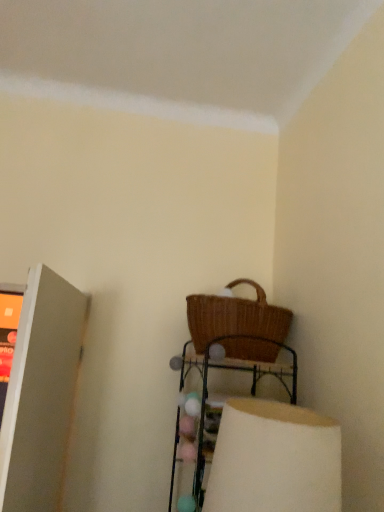
This screenshot has height=512, width=384. What do you see at coordinates (41, 393) in the screenshot?
I see `matte gray shelf at left` at bounding box center [41, 393].

Describe the element at coordinates (238, 324) in the screenshot. I see `woven brown picnic basket at lower right` at that location.

Find the location of a particular element. This screenshot has width=384, height=512. woven wicker basket at upper center is located at coordinates tap(222, 403).

The height and width of the screenshot is (512, 384). Find the location of `matte gray shelf at left`. matte gray shelf at left is located at coordinates (41, 393).

Between woven brown picnic basket at lower right and matte gray shelf at left, which one has larger width?

woven brown picnic basket at lower right.

Is matte gray shelf at left inside woven brown picnic basket at lower right?

Actually, matte gray shelf at left is outside woven brown picnic basket at lower right.

Who is more distant, woven brown picnic basket at lower right or matte gray shelf at left?

woven brown picnic basket at lower right is more distant.

Who is taller, woven brown picnic basket at lower right or matte gray shelf at left?

matte gray shelf at left.

In the scene shown: Is woven brown picnic basket at lower right not near white matte lampshade at lower right?

woven brown picnic basket at lower right is near white matte lampshade at lower right, not far away.

In the scene shown: Between woven brown picnic basket at lower right and white matte lampshade at lower right, which one has smaller width?

white matte lampshade at lower right is thinner.

Is woven brown picnic basket at lower right surrounding white matte lampshade at lower right?

No, woven brown picnic basket at lower right does not contain white matte lampshade at lower right.

Image resolution: width=384 pixels, height=512 pixels. I want to click on lamp lying below the woven brown picnic basket at lower right (from the image's perspective), so click(274, 459).

From a real-world perspective, which is physically above, woven wicker basket at upper center or matte gray shelf at left?

From a 3D spatial view, matte gray shelf at left is above.

How far apart are woven wicker basket at upper center and matte gray shelf at left?

woven wicker basket at upper center and matte gray shelf at left are 22.23 inches apart from each other.

You are a GUI agent. You are given a task and a screenshot of the screen. Output one action in this format:
    pyautogui.click(x=<x>, y=<y>)
    Task: Click on the furniture that is behind the matte gray shelf at left
    This screenshot has width=384, height=512.
    Given the screenshot: What is the action you would take?
    pyautogui.click(x=222, y=403)

Considering the sizes of objects woven wicker basket at upper center and matte gray shelf at left in the image provided, who is shorter, woven wicker basket at upper center or matte gray shelf at left?

Standing shorter between the two is woven wicker basket at upper center.

Image resolution: width=384 pixels, height=512 pixels. In order to click on picnic basket above the woven wicker basket at upper center (from a real-world perspective) in this screenshot , I will do `click(238, 324)`.

Is woven wicker basket at upper center facing towards woven brown picnic basket at lower right?

No, woven wicker basket at upper center is not aimed at woven brown picnic basket at lower right.

How different are the orientations of woven wicker basket at upper center and woven brown picnic basket at lower right in degrees?

The facing directions of woven wicker basket at upper center and woven brown picnic basket at lower right are 6.55 degrees apart.

In the scene shown: How much distance is there between woven wicker basket at upper center and woven brown picnic basket at lower right?

woven wicker basket at upper center is 5.32 inches away from woven brown picnic basket at lower right.

Does woven brown picnic basket at lower right have a smaller size compared to woven wicker basket at upper center?

Indeed, woven brown picnic basket at lower right has a smaller size compared to woven wicker basket at upper center.

Is point (261, 302) behind point (198, 450)?

Yes.

From the picture: How distant is woven brown picnic basket at lower right from woven wicker basket at upper center?

woven brown picnic basket at lower right is 5.32 inches from woven wicker basket at upper center.

Is the depth of woven brown picnic basket at lower right greater than that of woven wicker basket at upper center?

Yes, it is behind woven wicker basket at upper center.

Looking at this image, from the image's perspective, between white matte lampshade at lower right and matte gray shelf at left, who is located below?

white matte lampshade at lower right is shown below in the image.

Is white matte lampshade at lower right positioned far away from matte gray shelf at left?

That's not correct — white matte lampshade at lower right is a little close to matte gray shelf at left.

Considering the points (293, 433) and (20, 437), which point is behind, point (293, 433) or point (20, 437)?

The point (20, 437) is farther from the camera.

Would you say matte gray shelf at left is part of white matte lampshade at lower right's contents?

No.

Considering the relative sizes of white matte lampshade at lower right and woven wicker basket at upper center in the image provided, is white matte lampshade at lower right thinner than woven wicker basket at upper center?

Indeed, white matte lampshade at lower right has a lesser width compared to woven wicker basket at upper center.

Who is more distant, white matte lampshade at lower right or woven wicker basket at upper center?

woven wicker basket at upper center is behind.

Between white matte lampshade at lower right and woven wicker basket at upper center, which one has larger size?

With larger size is woven wicker basket at upper center.

Between white matte lampshade at lower right and woven wicker basket at upper center, which one appears on the left side from the viewer's perspective?

Positioned to the left is woven wicker basket at upper center.

The width and height of the screenshot is (384, 512). Identify the location of picnic basket positioned vertically above the matte gray shelf at left (from a real-world perspective). (238, 324).

Locate an element on the screen. Image resolution: width=384 pixels, height=512 pixels. lamp directly beneath the woven brown picnic basket at lower right (from a real-world perspective) is located at coordinates (274, 459).

Which object lies further to the anchor point woven wicker basket at upper center, woven brown picnic basket at lower right or matte gray shelf at left?

The object further to woven wicker basket at upper center is matte gray shelf at left.

Based on their spatial positions, is white matte lampshade at lower right or woven brown picnic basket at lower right further from woven wicker basket at upper center?

Based on the image, white matte lampshade at lower right appears to be further to woven wicker basket at upper center.

Considering their positions, is woven wicker basket at upper center positioned closer to white matte lampshade at lower right than woven brown picnic basket at lower right?

The object closer to white matte lampshade at lower right is woven wicker basket at upper center.

In the scene shown: When comparing their distances from woven wicker basket at upper center, does matte gray shelf at left or white matte lampshade at lower right seem further?

matte gray shelf at left lies further to woven wicker basket at upper center than the other object.

Estimate the real-world distances between objects in this image. Which object is further from woven brown picnic basket at lower right, matte gray shelf at left or white matte lampshade at lower right?

matte gray shelf at left is further to woven brown picnic basket at lower right.

Based on their spatial positions, is woven brown picnic basket at lower right or woven wicker basket at upper center further from matte gray shelf at left?

woven brown picnic basket at lower right.

Considering their positions, is woven brown picnic basket at lower right positioned closer to woven wicker basket at upper center than white matte lampshade at lower right?

Based on the image, woven brown picnic basket at lower right appears to be nearer to woven wicker basket at upper center.

When comparing their distances from matte gray shelf at left, does white matte lampshade at lower right or woven brown picnic basket at lower right seem further?

The object further to matte gray shelf at left is white matte lampshade at lower right.

Where is `lamp between matte gray shelf at left and woven brown picnic basket at lower right in the horizontal direction`? lamp between matte gray shelf at left and woven brown picnic basket at lower right in the horizontal direction is located at coordinates (274, 459).

Where is `furniture between matte gray shelf at left and woven brown picnic basket at lower right from left to right`? Image resolution: width=384 pixels, height=512 pixels. furniture between matte gray shelf at left and woven brown picnic basket at lower right from left to right is located at coordinates (222, 403).

Where is `furniture located between matte gray shelf at left and white matte lampshade at lower right in the left-right direction`? The width and height of the screenshot is (384, 512). furniture located between matte gray shelf at left and white matte lampshade at lower right in the left-right direction is located at coordinates (222, 403).

Locate an element on the screen. The height and width of the screenshot is (512, 384). furniture between white matte lampshade at lower right and woven brown picnic basket at lower right along the z-axis is located at coordinates (222, 403).